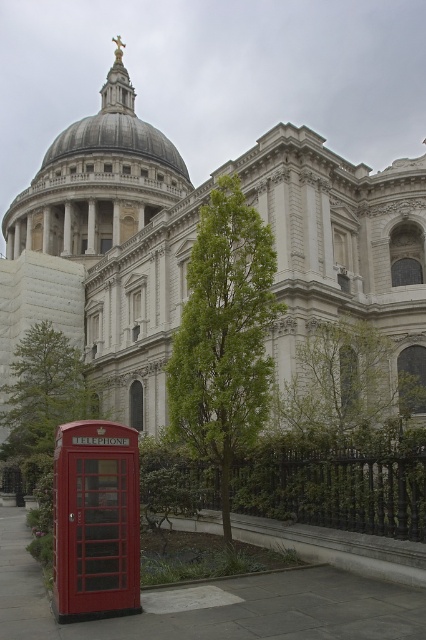
Question: Can you confirm if metallic red telephone box at lower left is smaller than green leafy tree at lower left?

Choices:
 (A) no
 (B) yes

Answer: (B)

Question: Which of the following is the closest to the observer?

Choices:
 (A) (167, 172)
 (B) (226, 481)
 (C) (83, 516)

Answer: (C)

Question: Is metallic red telephone box at lower left in front of green leafy tree at lower left?

Choices:
 (A) yes
 (B) no

Answer: (A)

Question: Does gray stone dome at center appear on the right side of green leafy tree at lower left?

Choices:
 (A) yes
 (B) no

Answer: (B)

Question: Among these points, which one is farthest from the camera?

Choices:
 (A) (204, 269)
 (B) (170, 182)
 (C) (14, 410)

Answer: (B)

Question: Which point is closer to the camera taking this photo?

Choices:
 (A) (69, 464)
 (B) (187, 179)
 (C) (40, 428)

Answer: (A)